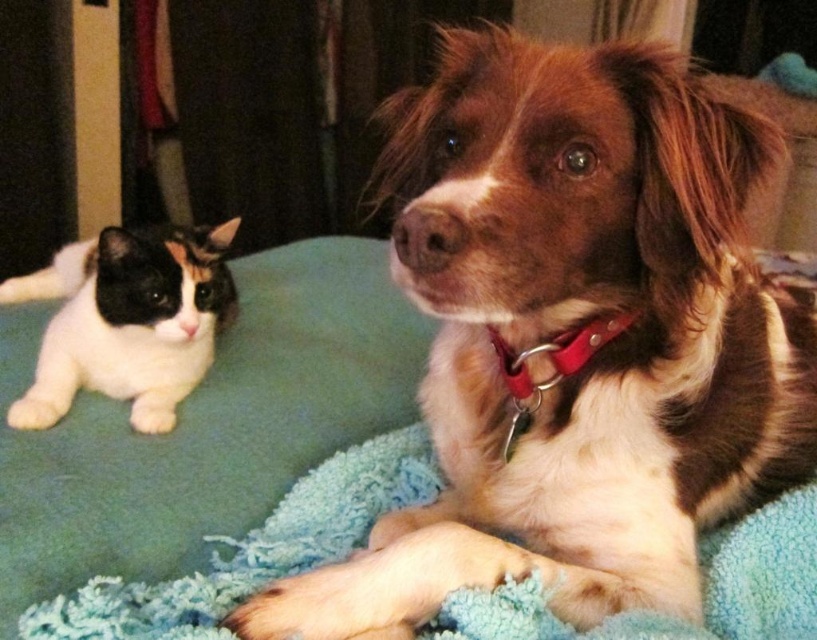
Question: Which point is closer to the camera?

Choices:
 (A) white fur cat at left
 (B) red leather collar at center

Answer: (B)

Question: Which point is closer to the camera taking this photo?

Choices:
 (A) (347, 564)
 (B) (408, 499)
 (C) (569, 349)

Answer: (A)

Question: In this image, where is white fur cat at left located relative to red leather collar at center?

Choices:
 (A) above
 (B) below

Answer: (A)

Question: Which of the following is the farthest from the observer?

Choices:
 (A) (74, 620)
 (B) (608, 333)
 (C) (208, 353)

Answer: (C)

Question: Does brown furry dog at center come in front of red leather collar at center?

Choices:
 (A) yes
 (B) no

Answer: (A)

Question: Observing the image, what is the correct spatial positioning of blue textured blanket at lower center in reference to white fur cat at left?

Choices:
 (A) left
 (B) right

Answer: (B)